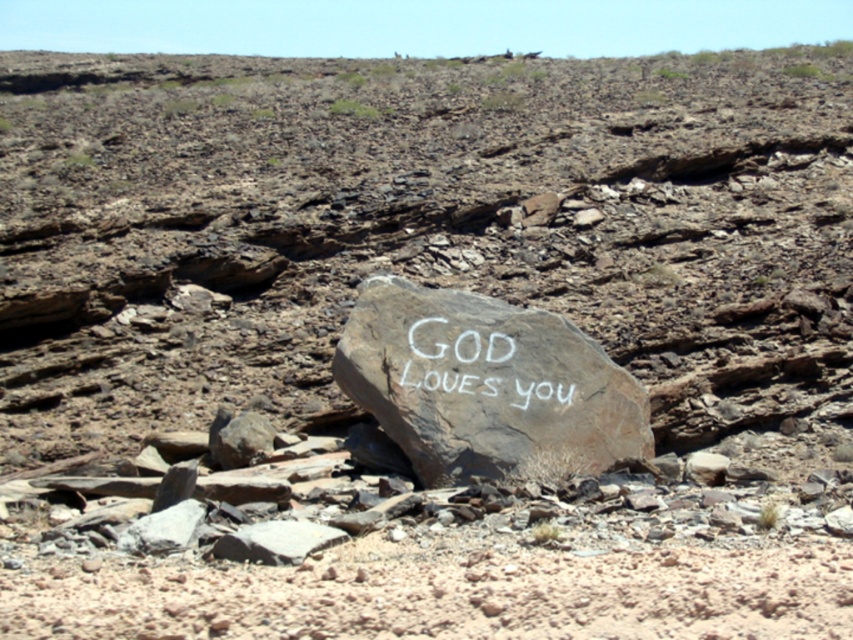
Between point (450, 467) and point (471, 381), which one is positioned behind?

The point (471, 381) is more distant.

Does natural stone boulder at center appear over white chalk writing at center?

No.

Does point (619, 381) lie behind point (496, 394)?

Yes, point (619, 381) is behind point (496, 394).

Where is `natural stone boulder at center`? natural stone boulder at center is located at coordinates (485, 385).